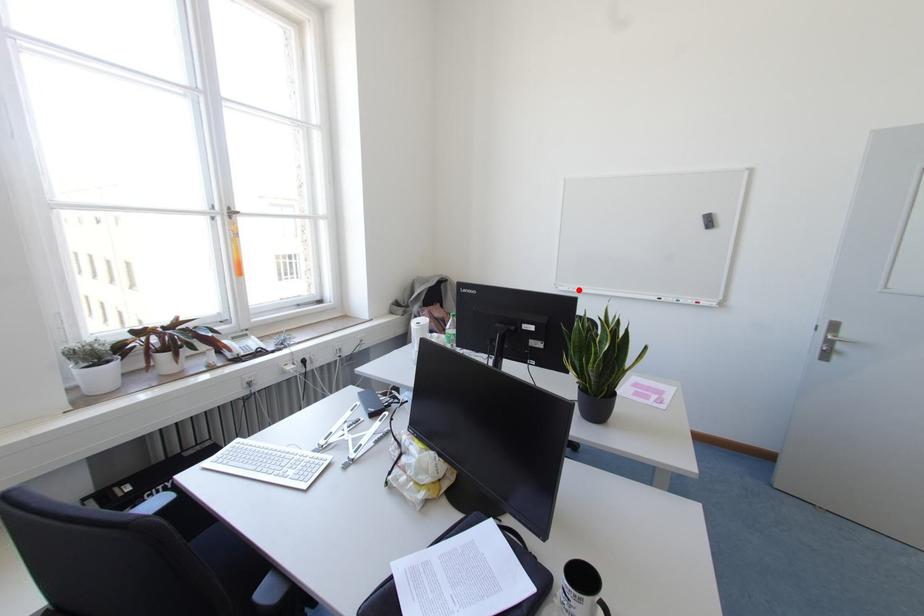
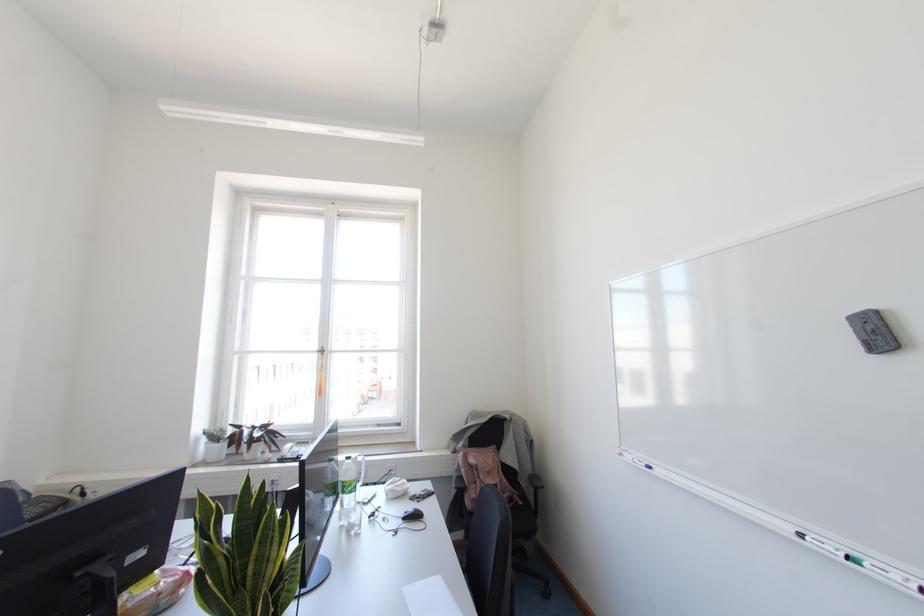
Where in the second image is the point corresponding to the highlighted location from the first image?

(649, 467)